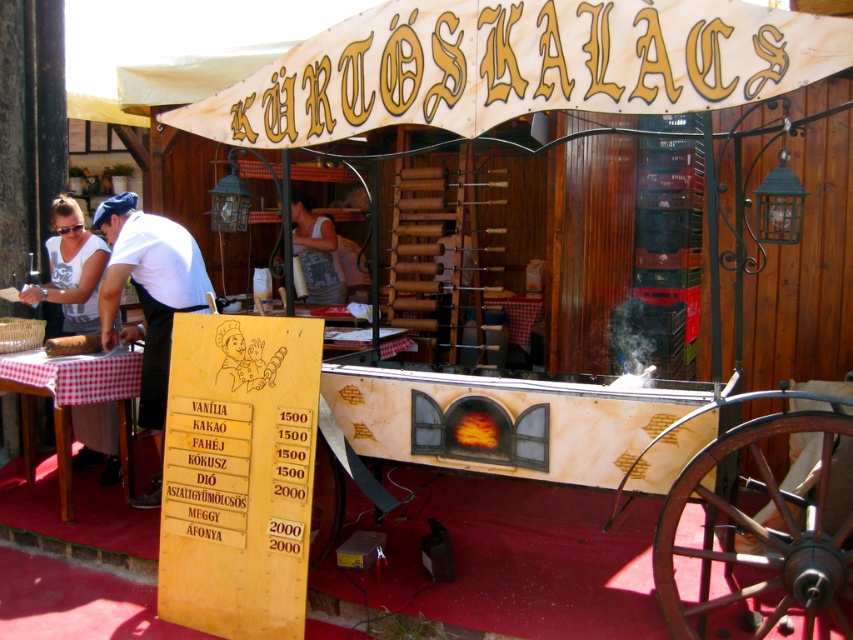
Does white fabric shirt at left have a greater width compared to brown wood log at lower left?

Indeed, white fabric shirt at left has a greater width compared to brown wood log at lower left.

Between white fabric shirt at left and brown wood log at lower left, which one has less height?

Standing shorter between the two is brown wood log at lower left.

Is point (102, 428) positioned after point (77, 346)?

Yes, it is.

Identify the location of white fabric shirt at left. (71, 268).

Which is below, white shirt at left or white fabric apron at center?

Positioned lower is white shirt at left.

Is white shirt at left below white fabric apron at center?

Yes.

Is point (161, 305) positioned before point (309, 284)?

Yes, point (161, 305) is in front of point (309, 284).

The width and height of the screenshot is (853, 640). I want to click on white shirt at left, so click(x=148, y=291).

Can you confirm if white fabric shirt at left is bigger than white fabric apron at center?

Indeed, white fabric shirt at left has a larger size compared to white fabric apron at center.

Find the location of `white fabric shirt at left`. white fabric shirt at left is located at coordinates (71, 268).